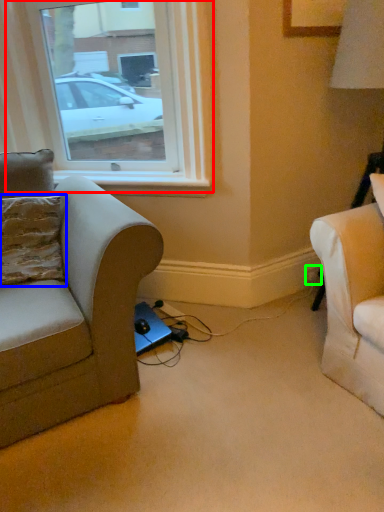
Question: Which object is positioned closest to window (highlighted by a red box)? Select from pillow (highlighted by a blue box) and electric outlet (highlighted by a green box).

Choices:
 (A) pillow
 (B) electric outlet

Answer: (A)